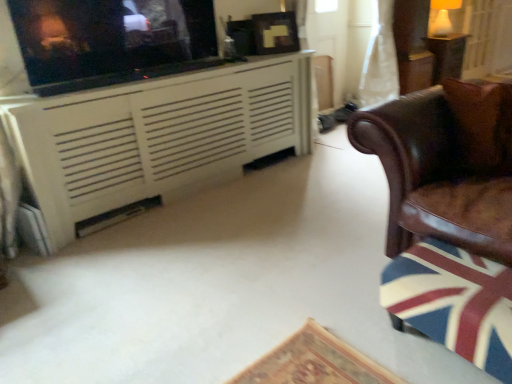
Question: In the image, is brown leather chair at right positioned in front of or behind wooden table at upper right?

Choices:
 (A) front
 (B) behind

Answer: (A)

Question: From a real-world perspective, is brown leather chair at right physically located above or below wooden table at upper right?

Choices:
 (A) above
 (B) below

Answer: (A)

Question: Which object is positioned farthest from the brown leather pillow at right?

Choices:
 (A) matte black tv at upper left
 (B) wooden table at upper right
 (C) white sheer curtain at upper right
 (D) white painted wood cabinet at upper left
 (E) brown leather chair at right

Answer: (B)

Question: Which object is the closest to the brown leather chair at right?

Choices:
 (A) matte black tv at upper left
 (B) wooden table at upper right
 (C) white glossy lampshade at upper right
 (D) white sheer curtain at upper right
 (E) wooden swivel chair at right

Answer: (E)